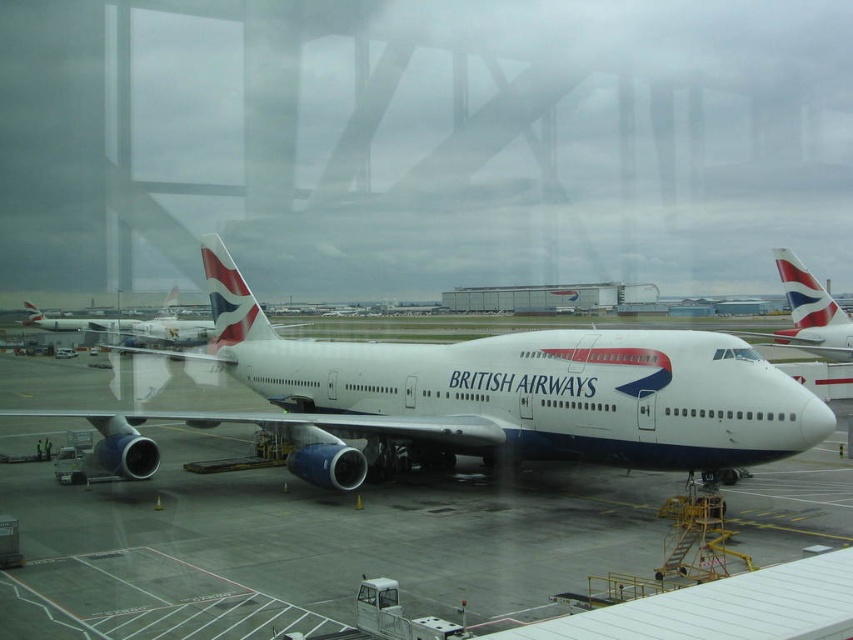
Is white glossy airplane at center below white glossy tail fin at center?

Indeed, white glossy airplane at center is positioned under white glossy tail fin at center.

Is point (404, 372) farther from camera compared to point (788, 301)?

No, (404, 372) is closer to viewer.

At what (x,y) coordinates should I click in order to perform the action: click on white glossy airplane at center. Please return your answer as a coordinate pair (x, y). Looking at the image, I should click on (498, 401).

Is white smooth tarmac at center further to the viewer compared to polished aluminum tail at center?

No, white smooth tarmac at center is in front of polished aluminum tail at center.

Can you confirm if white smooth tarmac at center is positioned to the left of polished aluminum tail at center?

Yes, white smooth tarmac at center is to the left of polished aluminum tail at center.

Image resolution: width=853 pixels, height=640 pixels. Describe the element at coordinates (363, 541) in the screenshot. I see `white smooth tarmac at center` at that location.

Find the location of a particular element. The width and height of the screenshot is (853, 640). white smooth tarmac at center is located at coordinates (363, 541).

Looking at this image, between white glossy airplane at center and white smooth tarmac at center, which one is positioned higher?

Positioned higher is white glossy airplane at center.

The image size is (853, 640). What do you see at coordinates (498, 401) in the screenshot?
I see `white glossy airplane at center` at bounding box center [498, 401].

The height and width of the screenshot is (640, 853). I want to click on white glossy airplane at center, so click(x=498, y=401).